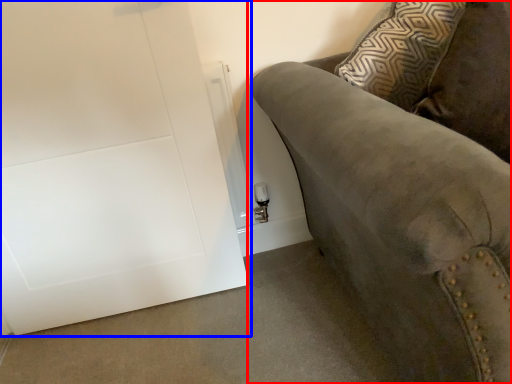
Question: Which of the following is the farthest to the observer, studio couch (highlighted by a red box) or door (highlighted by a blue box)?

Choices:
 (A) studio couch
 (B) door

Answer: (B)